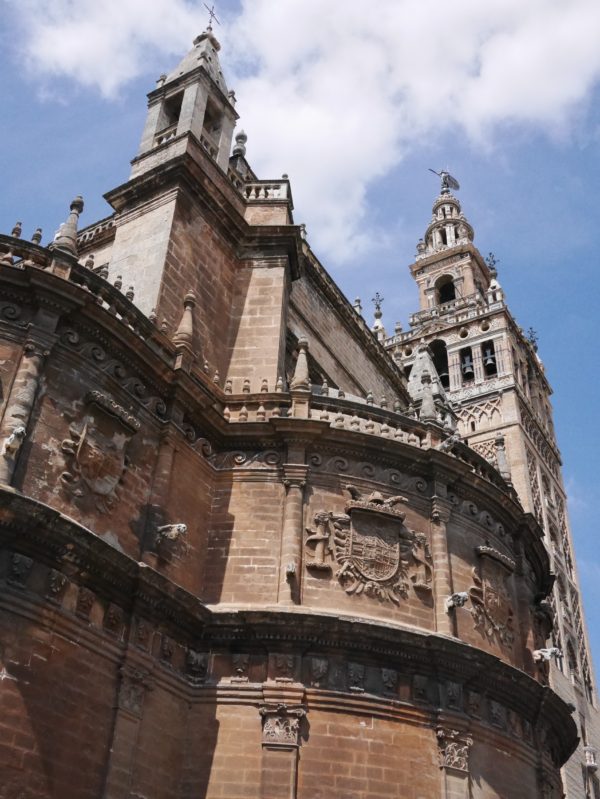
Find the location of a particular element. statue on the top right is located at coordinates (443, 180).